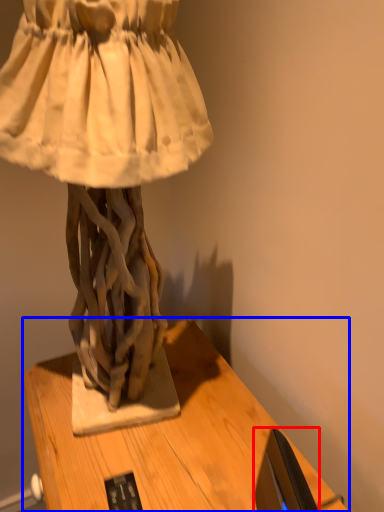
Question: Which object is further to the camera taking this photo, computer monitor (highlighted by a red box) or table (highlighted by a blue box)?

Choices:
 (A) computer monitor
 (B) table

Answer: (B)